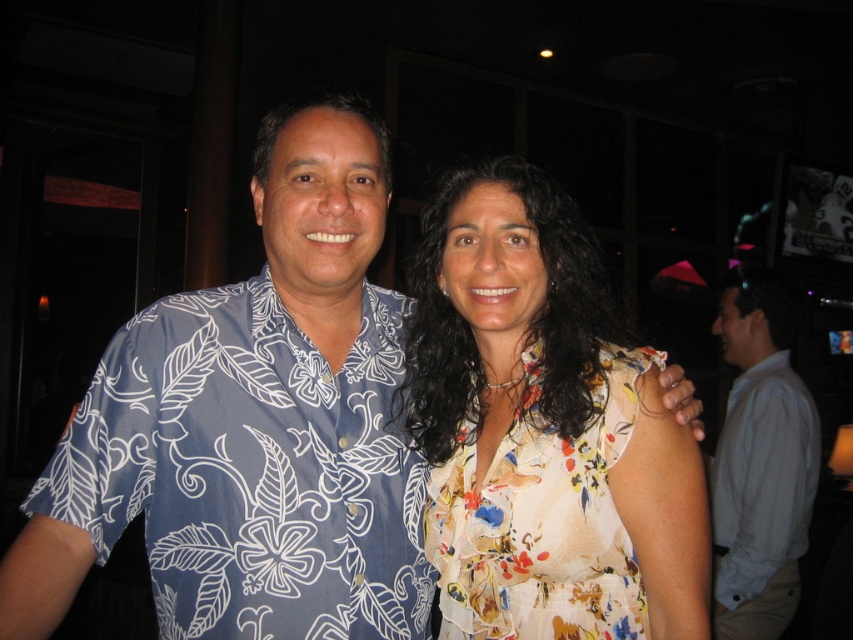
Can you confirm if blue floral-patterned shirt at left is positioned to the right of floral print fabric dress at center?

No, blue floral-patterned shirt at left is not to the right of floral print fabric dress at center.

Is blue floral-patterned shirt at left wider than floral print fabric dress at center?

Yes, blue floral-patterned shirt at left is wider than floral print fabric dress at center.

Between point (265, 362) and point (439, 484), which one is positioned in front?

Point (265, 362) is more forward.

Identify the location of blue floral-patterned shirt at left. The image size is (853, 640). (x=252, y=470).

Does blue floral shirt at center appear under light blue shirt at right?

No.

Is blue floral shirt at center smaller than light blue shirt at right?

Correct, blue floral shirt at center occupies less space than light blue shirt at right.

Image resolution: width=853 pixels, height=640 pixels. What do you see at coordinates (252, 426) in the screenshot?
I see `blue floral shirt at center` at bounding box center [252, 426].

Find the location of `blue floral shirt at center`. blue floral shirt at center is located at coordinates 252,426.

Where is `floral silk blouse at center`? Image resolution: width=853 pixels, height=640 pixels. floral silk blouse at center is located at coordinates (527, 413).

Who is more forward, (422, 225) or (453, 573)?

Positioned in front is point (453, 573).

Is point (506, 449) in front of point (599, 372)?

No, it is not.

Find the location of a particular element. This screenshot has height=640, width=853. floral silk blouse at center is located at coordinates (527, 413).